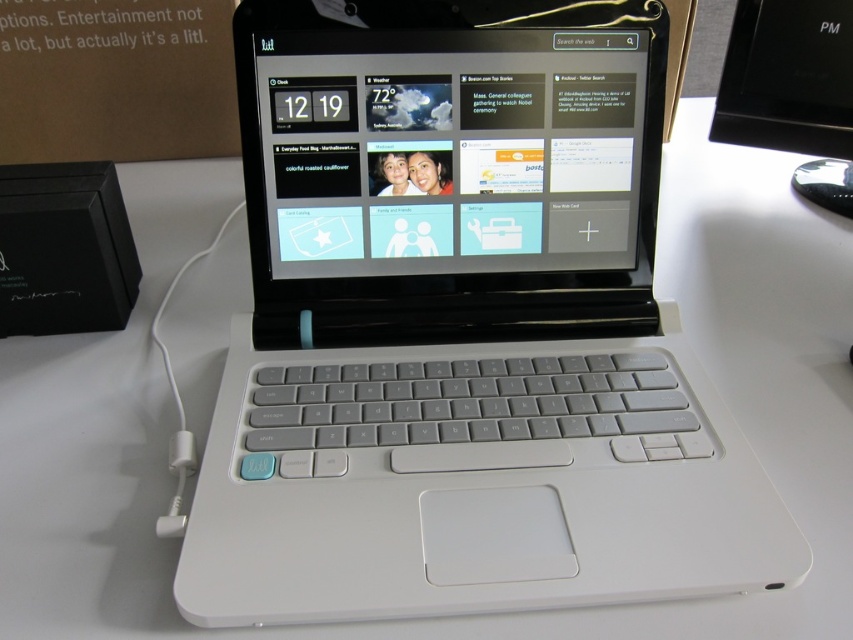
Consider the image. Is white matte laptop at center to the right of white matte mouse at center from the viewer's perspective?

Incorrect, white matte laptop at center is not on the right side of white matte mouse at center.

Can you confirm if white matte laptop at center is positioned to the left of white matte mouse at center?

Yes, white matte laptop at center is to the left of white matte mouse at center.

Identify the location of white matte laptop at center. This screenshot has width=853, height=640. (459, 320).

You are a GUI agent. You are given a task and a screenshot of the screen. Output one action in this format:
    pyautogui.click(x=<x>, y=<y>)
    Task: Click on the white matte laptop at center
    The image size is (853, 640).
    Given the screenshot: What is the action you would take?
    pyautogui.click(x=459, y=320)

Can you confirm if matte black screen at center is smaller than white matte mouse at center?

No.

Does matte black screen at center have a larger size compared to white matte mouse at center?

Yes.

Describe the element at coordinates (453, 150) in the screenshot. I see `matte black screen at center` at that location.

This screenshot has width=853, height=640. Find the location of `matte black screen at center`. matte black screen at center is located at coordinates (453, 150).

Does white matte laptop at center have a lesser width compared to matte black screen at center?

In fact, white matte laptop at center might be wider than matte black screen at center.

Is white matte laptop at center in front of matte black screen at center?

Yes, it is in front of matte black screen at center.

Identify the location of white matte laptop at center. (459, 320).